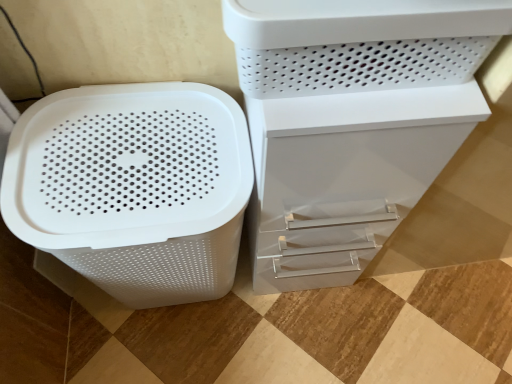
Question: Is white matte plastic basket at left taller than white plastic container at upper right?

Choices:
 (A) yes
 (B) no

Answer: (A)

Question: Considering the relative sizes of white matte plastic basket at left and white plastic container at upper right in the image provided, is white matte plastic basket at left shorter than white plastic container at upper right?

Choices:
 (A) no
 (B) yes

Answer: (A)

Question: Is white matte plastic basket at left looking in the opposite direction of white plastic container at upper right?

Choices:
 (A) no
 (B) yes

Answer: (A)

Question: Considering the relative positions of white matte plastic basket at left and white plastic container at upper right in the image provided, is white matte plastic basket at left to the left of white plastic container at upper right from the viewer's perspective?

Choices:
 (A) yes
 (B) no

Answer: (A)

Question: Can you confirm if white matte plastic basket at left is bigger than white plastic container at upper right?

Choices:
 (A) yes
 (B) no

Answer: (A)

Question: Could you tell me if white matte plastic basket at left is turned towards white plastic container at upper right?

Choices:
 (A) yes
 (B) no

Answer: (B)

Question: Is white matte plastic basket at left in contact with white plastic file cabinet at center?

Choices:
 (A) no
 (B) yes

Answer: (A)

Question: From a real-world perspective, is white matte plastic basket at left on top of white plastic file cabinet at center?

Choices:
 (A) yes
 (B) no

Answer: (B)

Question: Is white matte plastic basket at left not near white plastic file cabinet at center?

Choices:
 (A) no
 (B) yes

Answer: (A)

Question: Is white matte plastic basket at left in front of white plastic file cabinet at center?

Choices:
 (A) no
 (B) yes

Answer: (A)

Question: Is white plastic file cabinet at center a part of white matte plastic basket at left?

Choices:
 (A) no
 (B) yes

Answer: (A)

Question: Can you confirm if white matte plastic basket at left is thinner than white plastic file cabinet at center?

Choices:
 (A) no
 (B) yes

Answer: (A)

Question: Can you confirm if white plastic file cabinet at center is thinner than white plastic container at upper right?

Choices:
 (A) no
 (B) yes

Answer: (A)